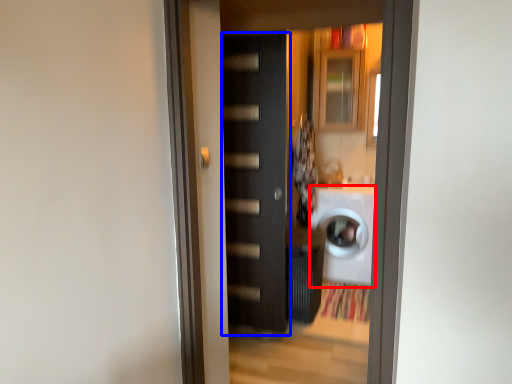
Question: Which of the following is the farthest to the observer, washing machine (highlighted by a red box) or door (highlighted by a blue box)?

Choices:
 (A) washing machine
 (B) door

Answer: (A)